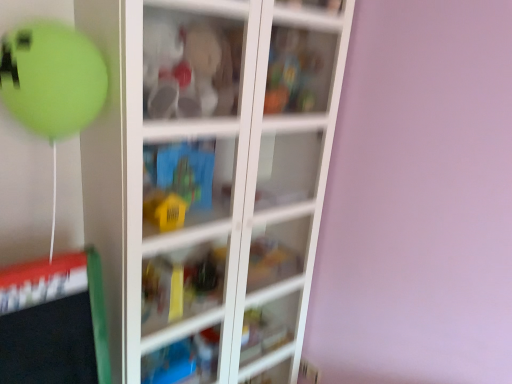
Question: Is blue plastic toy at center, which is counted as the first cabinet, starting from the bottom, facing away from transparent plastic cabinet at upper center, which appears as the first cabinet when viewed from the right?

Choices:
 (A) yes
 (B) no

Answer: (B)

Question: Does blue plastic toy at center, the 1th cabinet in the left-to-right sequence, have a smaller size compared to transparent plastic cabinet at upper center, arranged as the second cabinet when ordered from the bottom?

Choices:
 (A) no
 (B) yes

Answer: (B)

Question: From the image's perspective, is blue plastic toy at center, which is counted as the first cabinet, starting from the bottom, on top of transparent plastic cabinet at upper center, which appears as the first cabinet when viewed from the right?

Choices:
 (A) yes
 (B) no

Answer: (B)

Question: Can you confirm if blue plastic toy at center, which is counted as the first cabinet, starting from the bottom, is bigger than transparent plastic cabinet at upper center, arranged as the second cabinet when ordered from the bottom?

Choices:
 (A) yes
 (B) no

Answer: (B)

Question: Is blue plastic toy at center, the 2th cabinet viewed from the right, closer to camera compared to transparent plastic cabinet at upper center, arranged as the 1th cabinet when viewed from the top?

Choices:
 (A) no
 (B) yes

Answer: (B)

Question: Considering the positions of transparent glass cabinet at center and blue plastic toy at center, the 2th cabinet viewed from the right, in the image, is transparent glass cabinet at center bigger or smaller than blue plastic toy at center, the 2th cabinet viewed from the right,?

Choices:
 (A) small
 (B) big

Answer: (B)

Question: Choose the correct answer: Is transparent glass cabinet at center inside blue plastic toy at center, the 2th cabinet viewed from the right, or outside it?

Choices:
 (A) inside
 (B) outside

Answer: (B)

Question: From their relative heights in the image, would you say transparent glass cabinet at center is taller or shorter than blue plastic toy at center, which is counted as the second cabinet, starting from the top?

Choices:
 (A) tall
 (B) short

Answer: (A)

Question: Would you say transparent glass cabinet at center is to the left or to the right of blue plastic toy at center, which is counted as the second cabinet, starting from the top, in the picture?

Choices:
 (A) right
 (B) left

Answer: (A)

Question: Considering their positions, is blue plastic toy at center, which is counted as the first cabinet, starting from the bottom, located in front of or behind transparent plastic cabinet at upper center, arranged as the second cabinet when ordered from the bottom?

Choices:
 (A) front
 (B) behind

Answer: (A)

Question: Looking at their shapes, would you say blue plastic toy at center, the 2th cabinet viewed from the right, is wider or thinner than transparent plastic cabinet at upper center, arranged as the 1th cabinet when viewed from the top?

Choices:
 (A) wide
 (B) thin

Answer: (B)

Question: Considering the relative positions of blue plastic toy at center, the 2th cabinet viewed from the right, and transparent plastic cabinet at upper center, marked as the second cabinet in a left-to-right arrangement, in the image provided, is blue plastic toy at center, the 2th cabinet viewed from the right, to the left or to the right of transparent plastic cabinet at upper center, marked as the second cabinet in a left-to-right arrangement,?

Choices:
 (A) left
 (B) right

Answer: (A)

Question: Is point (185, 187) closer or farther from the camera than point (321, 72)?

Choices:
 (A) farther
 (B) closer

Answer: (B)

Question: Considering the positions of point (176, 215) and point (181, 137), is point (176, 215) closer or farther from the camera than point (181, 137)?

Choices:
 (A) farther
 (B) closer

Answer: (A)

Question: Do you think blue plastic toy at center, the 1th cabinet in the left-to-right sequence, is within transparent glass cabinet at center, or outside of it?

Choices:
 (A) inside
 (B) outside

Answer: (A)